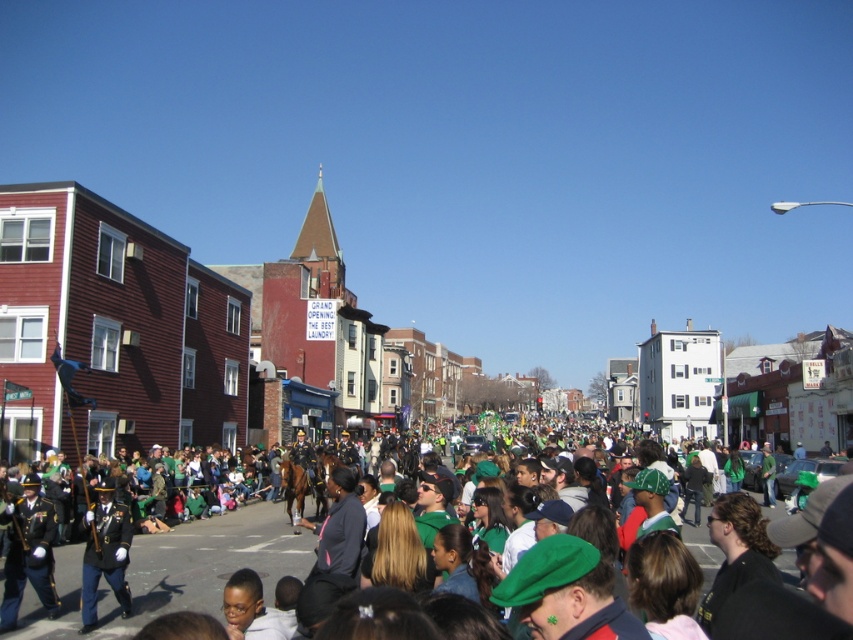
Question: Which object appears closest to the camera in this image?

Choices:
 (A) shiny gold uniform at center
 (B) green fabric flag at center
 (C) shiny black uniform at lower left

Answer: (B)

Question: Can you confirm if green fabric flag at center is positioned to the left of shiny black uniform at lower left?

Choices:
 (A) no
 (B) yes

Answer: (A)

Question: Among these objects, which one is nearest to the camera?

Choices:
 (A) green fabric flag at center
 (B) shiny gold uniform at center
 (C) shiny black uniform at lower left

Answer: (A)

Question: Which point is closer to the camera?

Choices:
 (A) (268, 595)
 (B) (112, 484)

Answer: (A)

Question: Is shiny gold uniform at center wider than shiny black uniform at lower left?

Choices:
 (A) yes
 (B) no

Answer: (B)

Question: Does shiny gold uniform at center have a greater width compared to shiny black uniform at lower left?

Choices:
 (A) yes
 (B) no

Answer: (B)